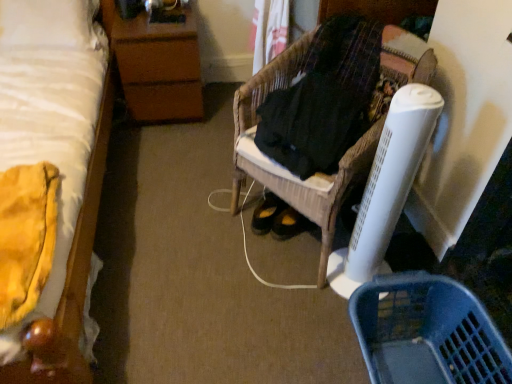
Question: From the image's perspective, is blue plastic basket at lower right located above or below black woven fabric at center?

Choices:
 (A) above
 (B) below

Answer: (B)

Question: Is blue plastic basket at lower right in front of or behind black woven fabric at center in the image?

Choices:
 (A) behind
 (B) front

Answer: (B)

Question: Based on their relative distances, which object is farther from the brown wood nightstand at upper left?

Choices:
 (A) woven wood chair at center
 (B) blue plastic basket at lower right
 (C) black woven fabric at center
 (D) white soft bed at left

Answer: (B)

Question: Considering the real-world distances, which object is farthest from the brown wood nightstand at upper left?

Choices:
 (A) white soft bed at left
 (B) woven wood chair at center
 (C) black woven fabric at center
 (D) blue plastic basket at lower right

Answer: (D)